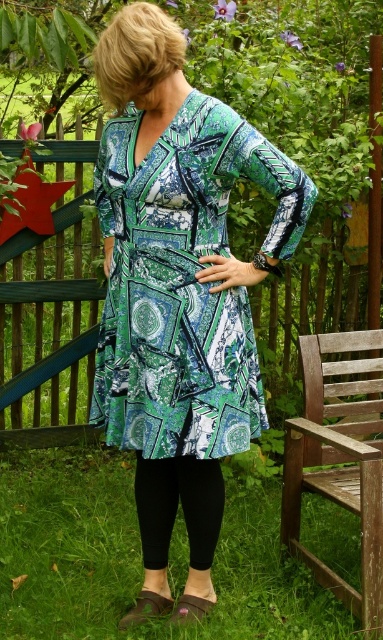
Consider the image. Does wooden park bench at lower right have a smaller size compared to black matte leggings at lower center?

No.

Which of these two, wooden park bench at lower right or black matte leggings at lower center, stands shorter?

Standing shorter between the two is black matte leggings at lower center.

Identify the location of wooden park bench at lower right. This screenshot has height=640, width=383. (340, 460).

This screenshot has height=640, width=383. I want to click on wooden park bench at lower right, so click(340, 460).

Between green grass at lower center and wooden park bench at lower right, which one is positioned higher?

wooden park bench at lower right is above.

Between point (3, 563) and point (363, 371), which one is positioned behind?

Positioned behind is point (3, 563).

The image size is (383, 640). What do you see at coordinates (140, 557) in the screenshot?
I see `green grass at lower center` at bounding box center [140, 557].

Find the location of a particular element. green grass at lower center is located at coordinates (140, 557).

Between point (158, 250) and point (137, 454), which one is positioned behind?

The point (137, 454) is behind.

Is green printed dress at center taller than black matte leggings at lower center?

Indeed, green printed dress at center has a greater height compared to black matte leggings at lower center.

Describe the element at coordinates (183, 282) in the screenshot. I see `green printed dress at center` at that location.

This screenshot has width=383, height=640. Find the location of `green printed dress at center`. green printed dress at center is located at coordinates (183, 282).